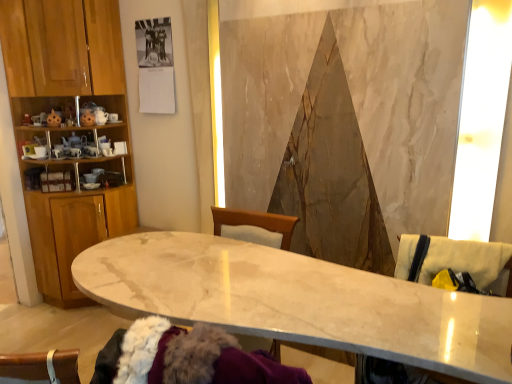
Where is `free spot above marble table at center (from a real-world perspective)`? free spot above marble table at center (from a real-world perspective) is located at coordinates (276, 289).